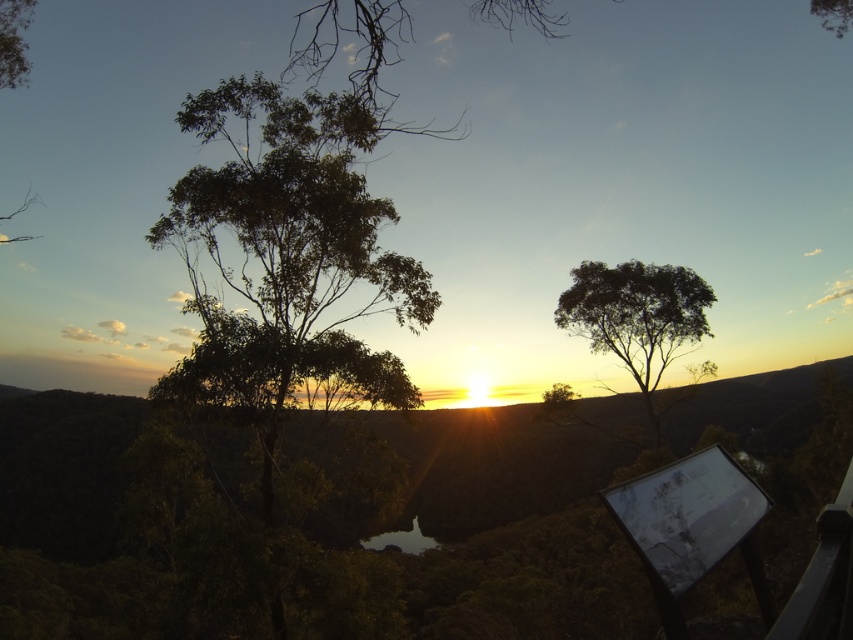
Who is higher up, green leafy tree at left or green leafy tree at center?

green leafy tree at left

This screenshot has height=640, width=853. What do you see at coordinates (286, 259) in the screenshot?
I see `green leafy tree at left` at bounding box center [286, 259].

You are a GUI agent. You are given a task and a screenshot of the screen. Output one action in this format:
    pyautogui.click(x=<x>, y=<y>)
    Task: Click on the green leafy tree at left
    
    Given the screenshot: What is the action you would take?
    pyautogui.click(x=286, y=259)